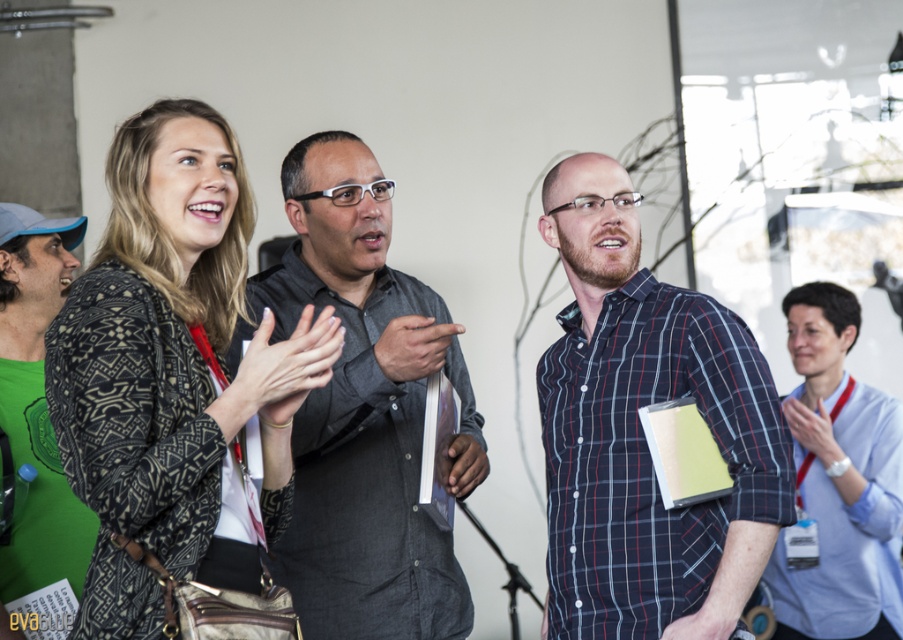
Based on the photo, you are a photographer standing behind the group and want to take a photo that includes both the dark gray shirt at center and the light blue shirt at right. The camera has a minimum focus distance of 1.5 meters. Can you capture both subjects in focus without moving the camera or subjects?

The distance between the dark gray shirt at center and the light blue shirt at right is 1.71 meters. Since the camera requires a minimum of 1.5 meters to focus, the photographer can capture both subjects in focus as the distance meets the requirement.

You are standing at the back of the room and want to get to the front. There is a dark gray shirt at center and a light blue shirt at right blocking your path. Which person should you go around to reach the front faster?

The dark gray shirt at center is positioned over light blue shirt at right, so you should go around the light blue shirt at right to reach the front faster since it is behind the dark gray shirt at center.